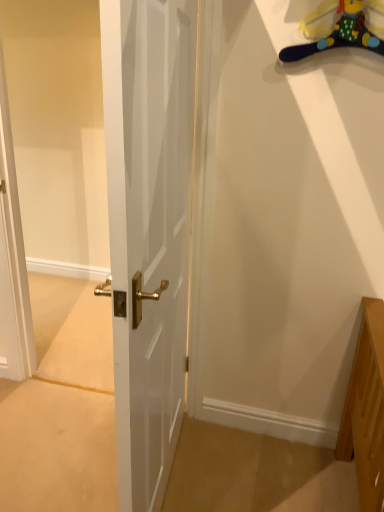
Question: In terms of width, does white glossy door at center look wider or thinner when compared to plush yellow duck at upper right?

Choices:
 (A) thin
 (B) wide

Answer: (B)

Question: In terms of size, does white glossy door at center appear bigger or smaller than plush yellow duck at upper right?

Choices:
 (A) small
 (B) big

Answer: (B)

Question: From a real-world perspective, is white glossy door at center above or below plush yellow duck at upper right?

Choices:
 (A) below
 (B) above

Answer: (A)

Question: Considering the relative positions of plush yellow duck at upper right and white glossy door at center in the image provided, is plush yellow duck at upper right to the left or to the right of white glossy door at center?

Choices:
 (A) right
 (B) left

Answer: (A)

Question: In terms of width, does plush yellow duck at upper right look wider or thinner when compared to white glossy door at center?

Choices:
 (A) thin
 (B) wide

Answer: (A)

Question: Considering their positions, is plush yellow duck at upper right located in front of or behind white glossy door at center?

Choices:
 (A) behind
 (B) front

Answer: (A)

Question: Choose the correct answer: Is plush yellow duck at upper right inside white glossy door at center or outside it?

Choices:
 (A) outside
 (B) inside

Answer: (A)